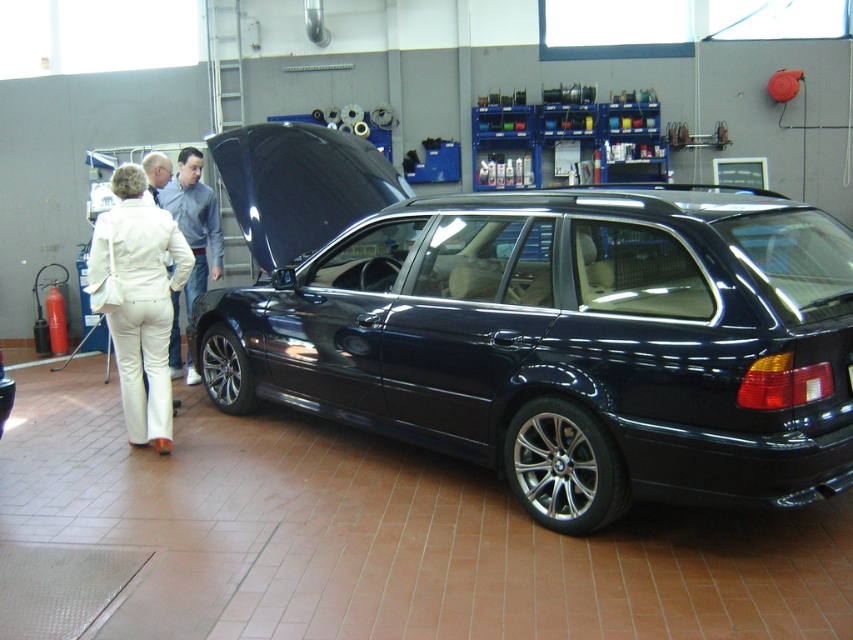
You are standing in the garage and want to locate the glossy black car at center. According to the coordinates provided, where would you find it?

The glossy black car at center is located at point coordinates of (x=543, y=326).

From the picture: You are a worker in the garage and need to store the white fabric pants at left and the blue fabric shirt at center in a small drawer. Which item would take up less space when folded?

The white fabric pants at left occupies less space than the blue fabric shirt at center, so it would take up less space when folded.